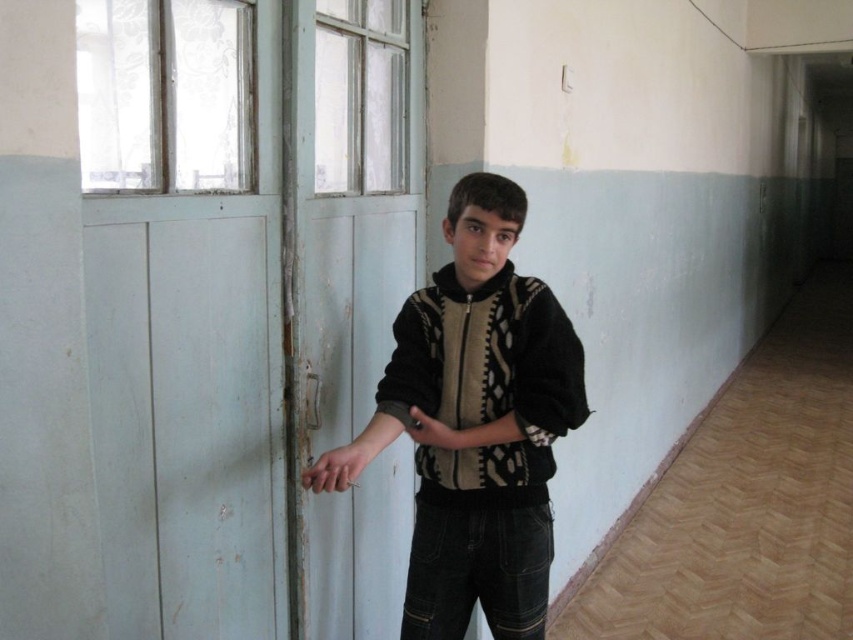
You are a fashion designer who wants to place a new accessory on the black textured sweater at center. According to the coordinates provided, where exactly should you place the accessory?

The black textured sweater at center is located at coordinates point (490,362), so you should place the accessory there.

You are a fashion designer observing the boy in the hallway. You need to determine the arrangement of his clothing items. Which clothing item is located below the other? The knitted sweater at center and the black matte arm at center are both visible. Please specify which is below the other.

The knitted sweater at center is positioned under the black matte arm at center, meaning the knitted sweater is below the black matte arm.